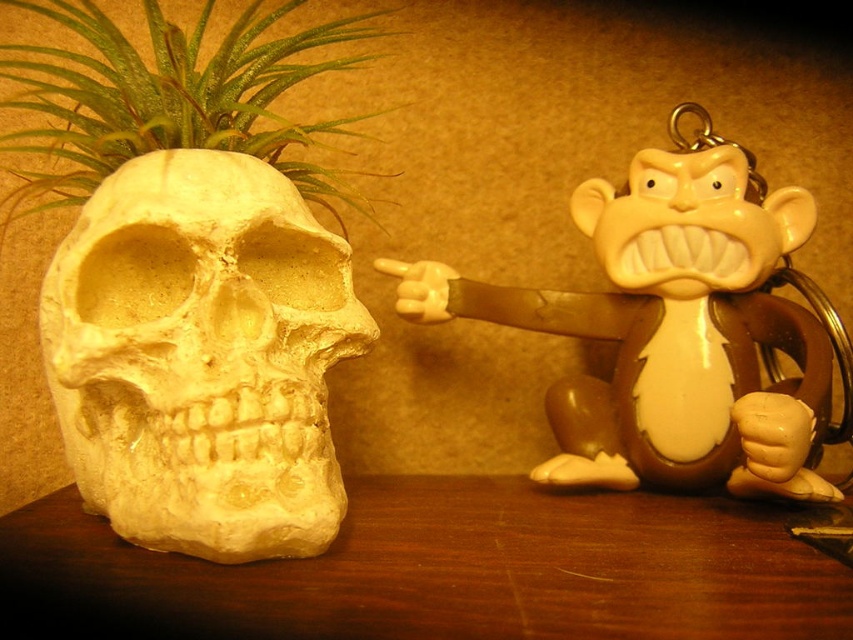
Question: From the image, what is the correct spatial relationship of white matte skull at left in relation to green leafy plant at left?

Choices:
 (A) right
 (B) left

Answer: (A)

Question: Is wooden table at lower center closer to the viewer compared to matte brown monkey at right?

Choices:
 (A) yes
 (B) no

Answer: (A)

Question: Can you confirm if white matte skull at left is wider than wooden table at lower center?

Choices:
 (A) no
 (B) yes

Answer: (A)

Question: Which point is closer to the camera?

Choices:
 (A) green leafy plant at left
 (B) wooden table at lower center
 (C) matte brown monkey at right
 (D) white matte skull at left

Answer: (B)

Question: Which point is closer to the camera?

Choices:
 (A) wooden table at lower center
 (B) white matte skull at left
 (C) matte brown monkey at right
 (D) green leafy plant at left

Answer: (A)

Question: Which point is closer to the camera taking this photo?

Choices:
 (A) click(x=103, y=172)
 (B) click(x=444, y=484)

Answer: (A)